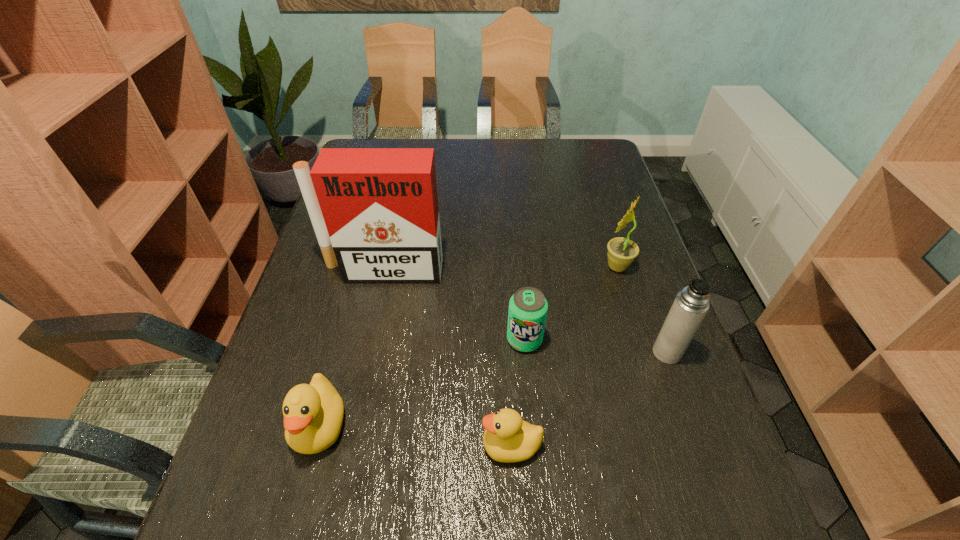
Identify the location of the taller duck. This screenshot has width=960, height=540. (313, 413).

The image size is (960, 540). Identify the location of the shorter duck. (507, 438).

This screenshot has height=540, width=960. What are the coordinates of `the shortest object` in the screenshot? It's located at (507, 438).

The height and width of the screenshot is (540, 960). I want to click on pop soda, so click(x=528, y=307).

Find the location of `the tallest object`. the tallest object is located at coordinates (375, 213).

This screenshot has width=960, height=540. What are the coordinates of `sunflower` in the screenshot? It's located at [621, 253].

The width and height of the screenshot is (960, 540). I want to click on thermos bottle, so click(690, 306).

Where is `vacant space located at the beak of the right duck`? vacant space located at the beak of the right duck is located at coordinates (425, 445).

Locate an element on the screen. vacant space located at the beak of the right duck is located at coordinates (379, 445).

Identify the location of free space located 0.330m at the beak of the right duck. Image resolution: width=960 pixels, height=540 pixels. (312, 445).